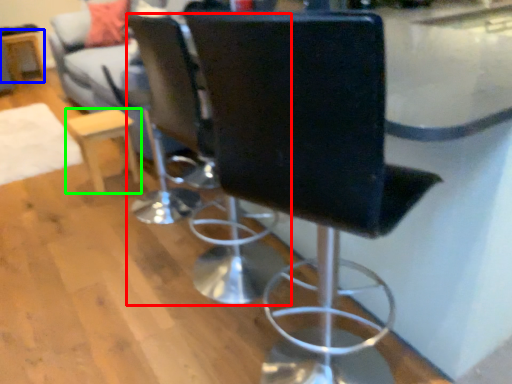
Question: Which object is positioned farthest from chair (highlighted by a red box)? Select from round table (highlighted by a blue box) and furniture (highlighted by a green box).

Choices:
 (A) round table
 (B) furniture

Answer: (A)